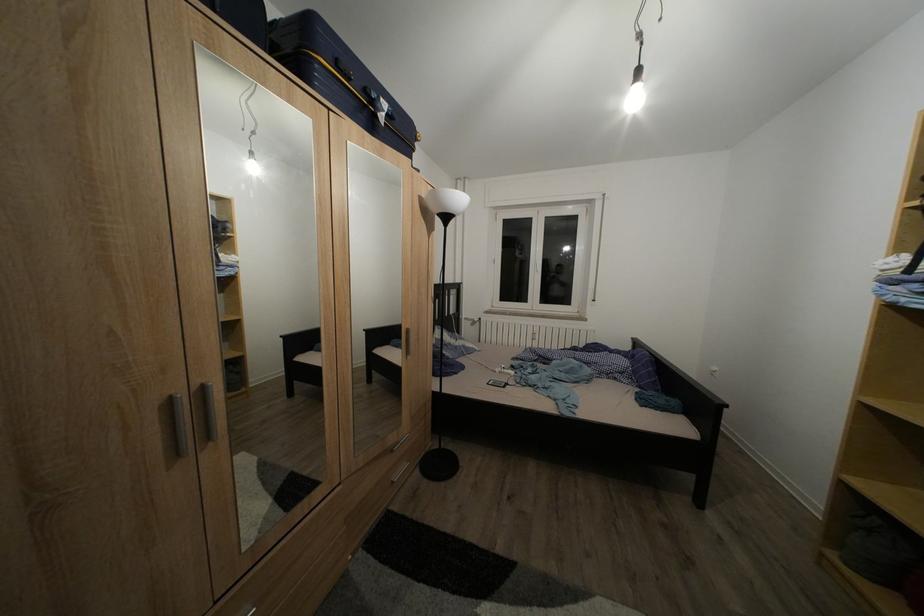
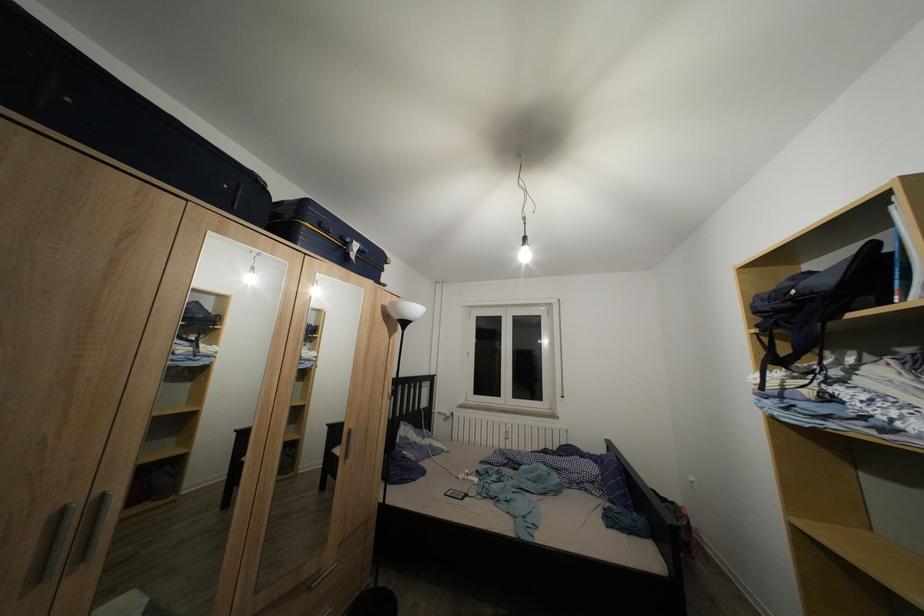
The point at (395,120) is marked in the first image. Where is the corresponding point in the second image?

(367, 257)